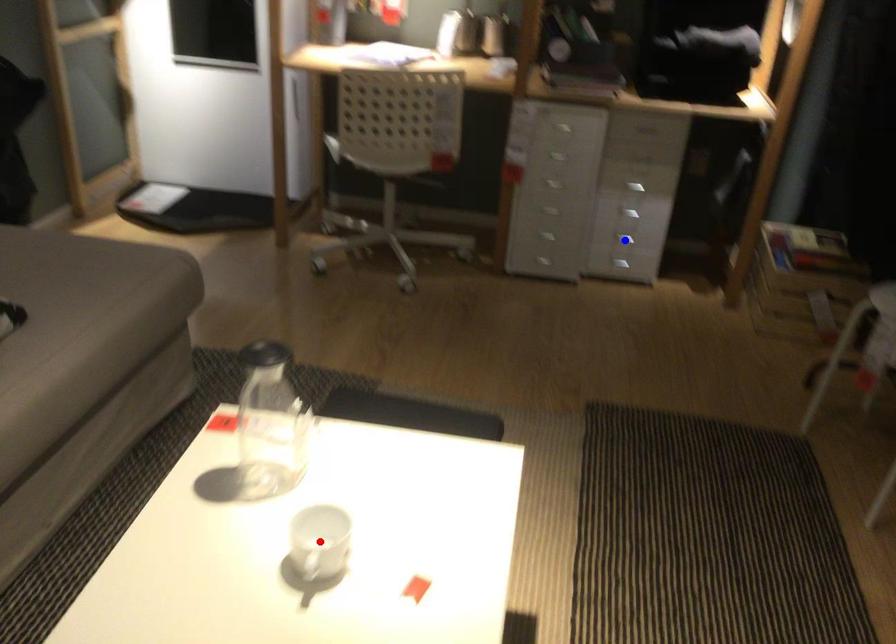
Question: Which of the two points in the image is closer to the camera?

Choices:
 (A) Blue point is closer.
 (B) Red point is closer.

Answer: (B)